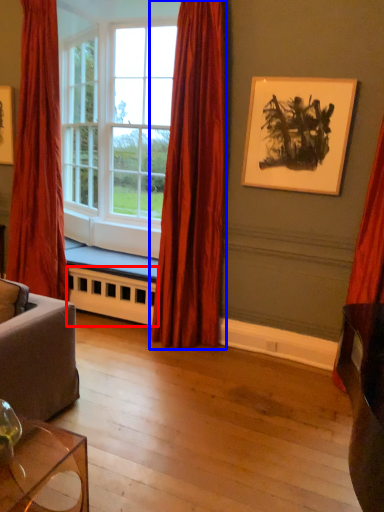
Question: Which object is further to the camera taking this photo, radiator (highlighted by a red box) or curtain (highlighted by a blue box)?

Choices:
 (A) radiator
 (B) curtain

Answer: (A)